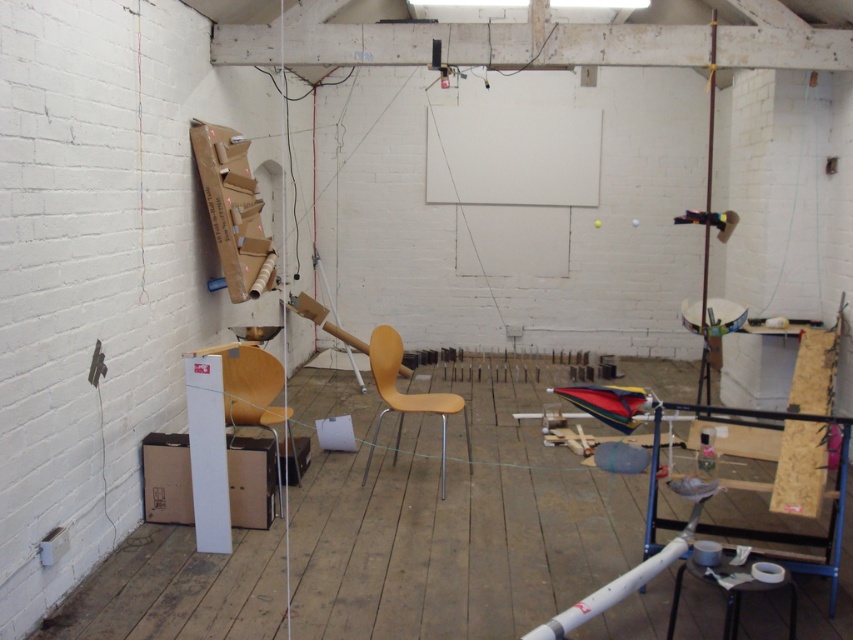
Can you confirm if white painted wood beam at upper center is wider than wooden pole at right?

Indeed, white painted wood beam at upper center has a greater width compared to wooden pole at right.

Who is more distant from viewer, (412, 60) or (711, 216)?

The point (711, 216) is behind.

Identify the location of white painted wood beam at upper center. The height and width of the screenshot is (640, 853). (460, 44).

Is light brown wood chair at center thinner than wooden pole at right?

No, light brown wood chair at center is not thinner than wooden pole at right.

Does light brown wood chair at center come behind wooden pole at right?

No.

Measure the distance between point (375,442) and camera.

5.08 meters

I want to click on light brown wood chair at center, so pos(403,394).

Who is positioned more to the right, light brown wood chair at center or black plastic stool at lower right?

black plastic stool at lower right

Measure the distance from light brown wood chair at center to black plastic stool at lower right.

light brown wood chair at center is 6.11 feet away from black plastic stool at lower right.

Is point (381, 353) in front of point (747, 566)?

No, (381, 353) is behind (747, 566).

Find the location of `light brown wood chair at center`. light brown wood chair at center is located at coordinates (403, 394).